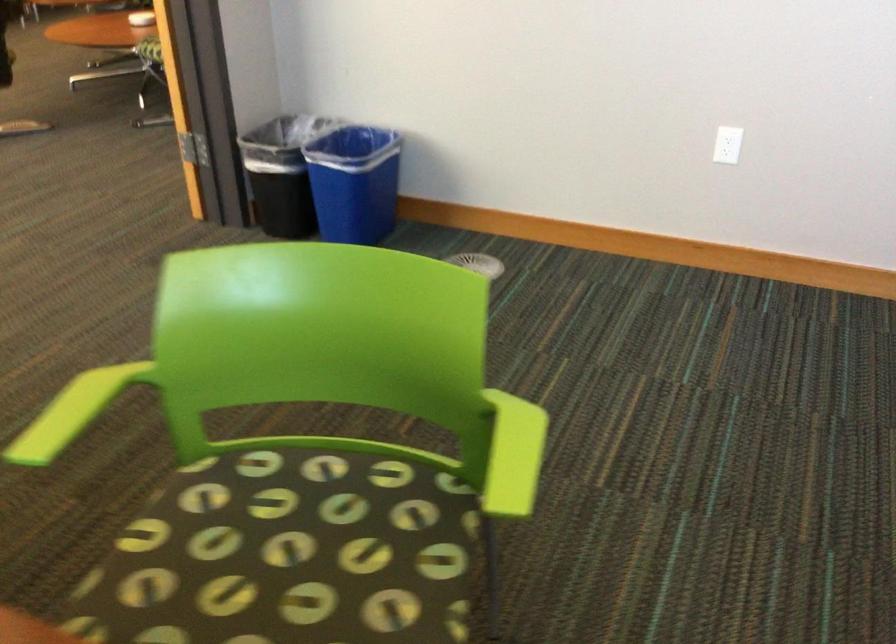
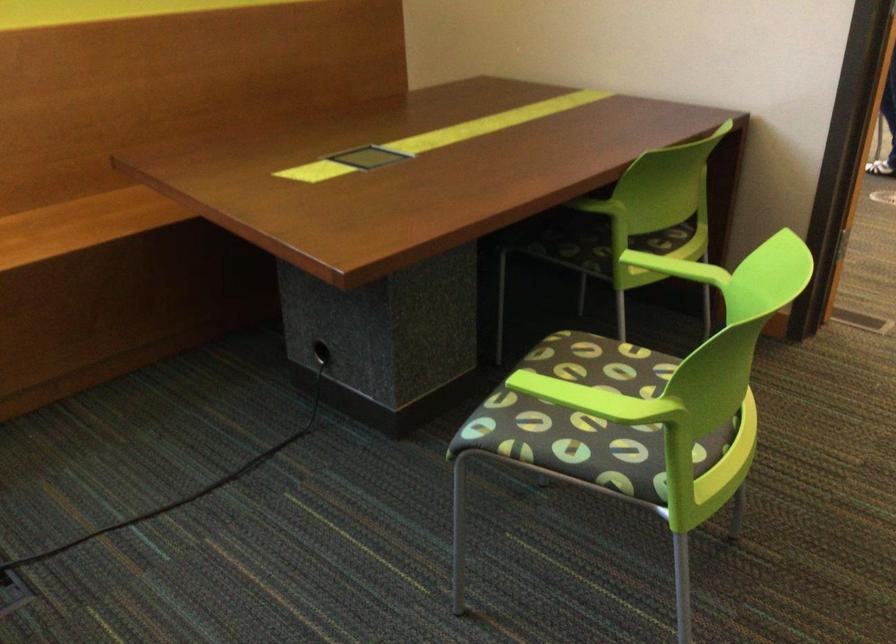
The point at (104, 395) is marked in the first image. Where is the corresponding point in the second image?

(676, 268)